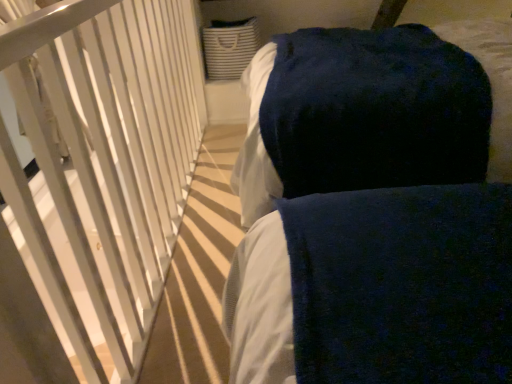
What do you see at coordinates (102, 171) in the screenshot?
I see `white matte railing at left` at bounding box center [102, 171].

I want to click on white matte railing at left, so click(102, 171).

The width and height of the screenshot is (512, 384). What are the coordinates of `white matte railing at left` in the screenshot? It's located at (102, 171).